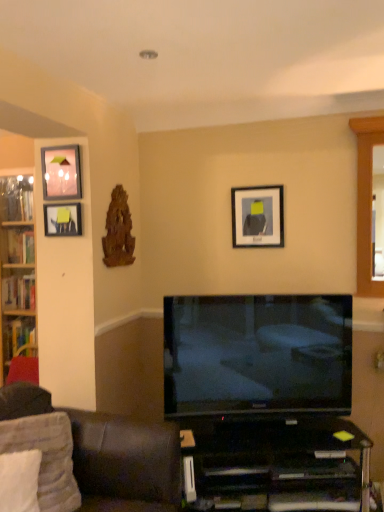
Question: From the image's perspective, is white fabric pillow at lower left, positioned as the 2th pillow in front-to-back order, below wooden bookshelf at left?

Choices:
 (A) no
 (B) yes

Answer: (B)

Question: Is wooden bookshelf at left inside white fabric pillow at lower left, positioned as the 2th pillow in front-to-back order?

Choices:
 (A) no
 (B) yes

Answer: (A)

Question: Can we say white fabric pillow at lower left, placed as the 1th pillow when sorted from back to front, lies outside wooden bookshelf at left?

Choices:
 (A) no
 (B) yes

Answer: (B)

Question: Is white fabric pillow at lower left, positioned as the 2th pillow in front-to-back order, facing towards wooden bookshelf at left?

Choices:
 (A) yes
 (B) no

Answer: (B)

Question: Is white fabric pillow at lower left, positioned as the 2th pillow in front-to-back order, further to the viewer compared to wooden bookshelf at left?

Choices:
 (A) no
 (B) yes

Answer: (A)

Question: From the image's perspective, is white soft pillow at lower left, placed as the 1th pillow when sorted from front to back, above or below matte black picture frame at left, which is counted as the 2th picture frame, starting from the front?

Choices:
 (A) above
 (B) below

Answer: (B)

Question: In terms of size, does white soft pillow at lower left, which ranks as the 2th pillow in back-to-front order, appear bigger or smaller than matte black picture frame at left, the third picture frame when ordered from right to left?

Choices:
 (A) small
 (B) big

Answer: (B)

Question: Considering the positions of white soft pillow at lower left, placed as the 1th pillow when sorted from front to back, and matte black picture frame at left, which is counted as the 2th picture frame, starting from the front, in the image, is white soft pillow at lower left, placed as the 1th pillow when sorted from front to back, taller or shorter than matte black picture frame at left, which is counted as the 2th picture frame, starting from the front,?

Choices:
 (A) tall
 (B) short

Answer: (A)

Question: Which is correct: white soft pillow at lower left, placed as the 1th pillow when sorted from front to back, is inside matte black picture frame at left, which is the 1th picture frame in left-to-right order, or outside of it?

Choices:
 (A) inside
 (B) outside

Answer: (B)

Question: Relative to flat screen tv at center, is matte black picture frame at upper center, arranged as the 1th picture frame when viewed from the right, in front or behind?

Choices:
 (A) behind
 (B) front

Answer: (A)

Question: Considering the positions of point (274, 217) and point (349, 402), is point (274, 217) closer or farther from the camera than point (349, 402)?

Choices:
 (A) closer
 (B) farther

Answer: (B)

Question: From the image's perspective, is matte black picture frame at upper center, which appears as the third picture frame when viewed from the front, above or below flat screen tv at center?

Choices:
 (A) above
 (B) below

Answer: (A)

Question: In terms of size, does matte black picture frame at upper center, the 3th picture frame in the left-to-right sequence, appear bigger or smaller than flat screen tv at center?

Choices:
 (A) big
 (B) small

Answer: (B)

Question: Is matte black picture frame at upper center, the 3th picture frame in the left-to-right sequence, inside the boundaries of dark brown leather couch at lower left, or outside?

Choices:
 (A) outside
 (B) inside

Answer: (A)

Question: Based on their positions, is matte black picture frame at upper center, the 3th picture frame in the left-to-right sequence, located to the left or right of dark brown leather couch at lower left?

Choices:
 (A) right
 (B) left

Answer: (A)